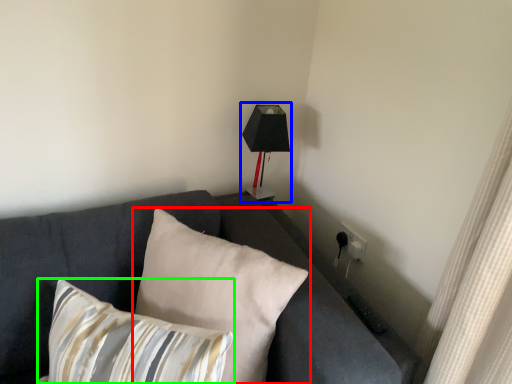
Question: Estimate the real-world distances between objects in this image. Which object is closer to pillow (highlighted by a red box), table lamp (highlighted by a blue box) or pillow (highlighted by a green box)?

Choices:
 (A) table lamp
 (B) pillow

Answer: (B)